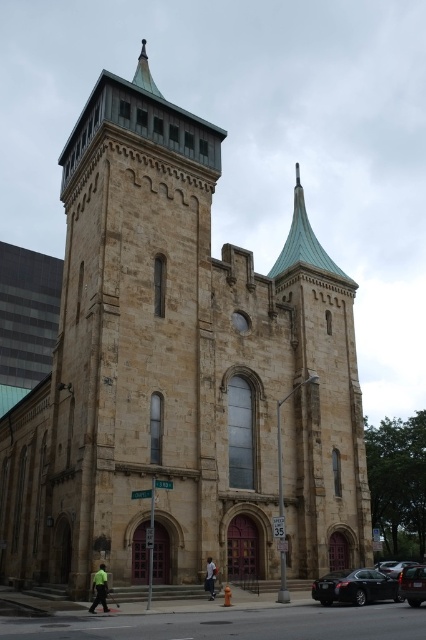
You are standing at the base of the historic stone church. You see the shiny copper spire at upper center and dark blue jeans at center. How far apart are these two objects in meters?

The shiny copper spire at upper center is 159.09 feet away from dark blue jeans at center, which converts to approximately 48.5 meters.

You are standing at the entrance of the historic stone church with Gothic architectural influences. You see a black matte car at lower right. Where is the point at coordinates point (354, 588) located?

The point at coordinates point (354, 588) is located on the black matte car at lower right.

You are standing in front of the historic stone church. You see the shiny copper spire at upper center and the green fabric person at lower left. Which object is higher in the image?

The shiny copper spire at upper center is higher than the green fabric person at lower left because it is positioned above it.